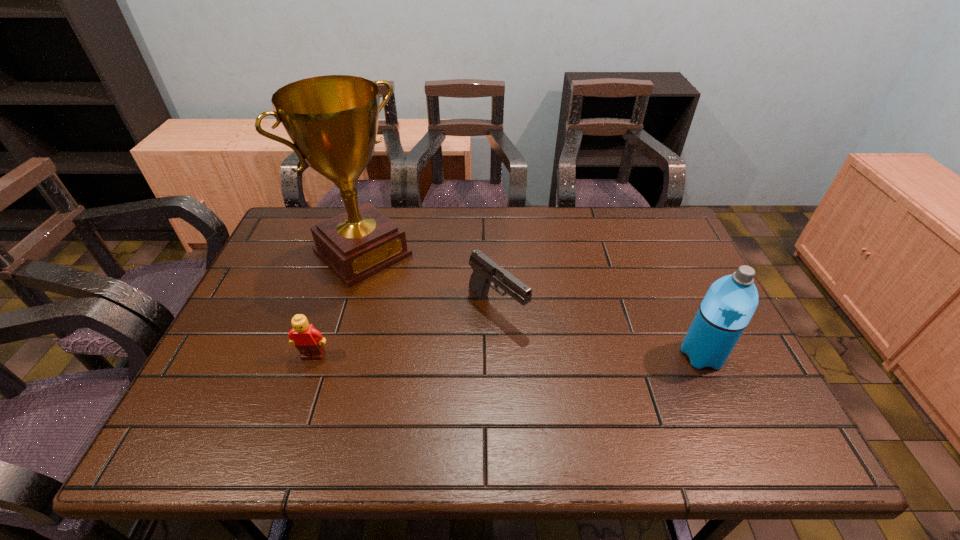
This screenshot has width=960, height=540. I want to click on unoccupied area between the third object from left to right and the Lego, so click(x=405, y=332).

Where is `object that is the closest to the rightmost object`? The width and height of the screenshot is (960, 540). object that is the closest to the rightmost object is located at coordinates (485, 270).

The width and height of the screenshot is (960, 540). Identify the location of the second closest object to the third object from left to right. click(308, 340).